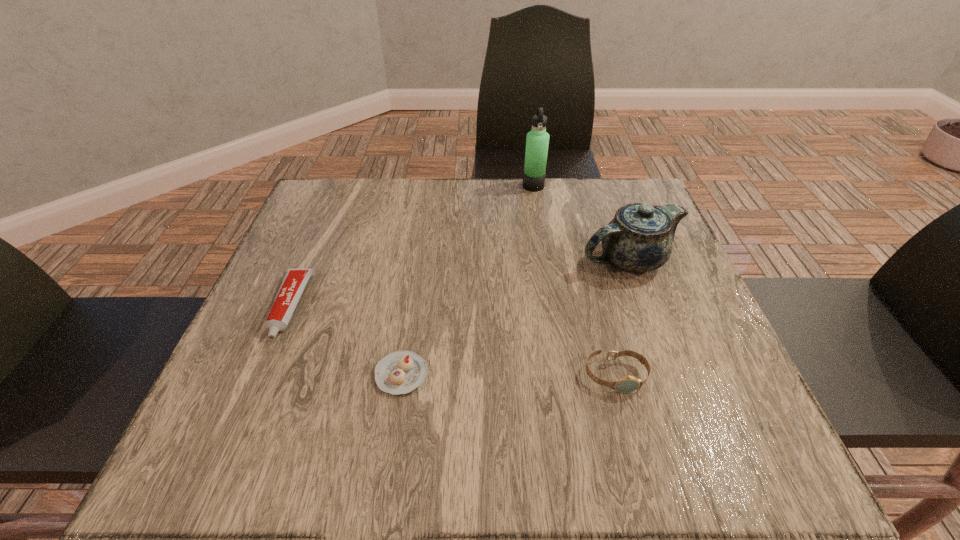
This screenshot has height=540, width=960. I want to click on the third object from left to right, so click(x=537, y=141).

Find the location of a particular element. This screenshot has height=540, width=960. the farthest object is located at coordinates (537, 141).

You are a GUI agent. You are given a task and a screenshot of the screen. Output one action in this format:
    pyautogui.click(x=<x>, y=<y>)
    Task: Click on the second tallest object
    The width and height of the screenshot is (960, 540).
    Given the screenshot: What is the action you would take?
    pyautogui.click(x=639, y=238)

This screenshot has height=540, width=960. I want to click on the third tallest object, so click(626, 384).

The height and width of the screenshot is (540, 960). I want to click on the leftmost object, so click(x=294, y=281).

You are a GUI agent. You are given a task and a screenshot of the screen. Output one action in this format:
    pyautogui.click(x=<x>, y=<y>)
    Task: Click on the second object from left to right
    This screenshot has height=540, width=960.
    Given the screenshot: What is the action you would take?
    pyautogui.click(x=400, y=372)

This screenshot has height=540, width=960. I want to click on free space located on the front of the farthest object, so click(547, 273).

Locate an element on the screen. blank area located from the spout of the second tallest object is located at coordinates (480, 260).

Image resolution: width=960 pixels, height=540 pixels. What are the coordinates of `free region located 0.230m from the spout of the second tallest object` in the screenshot? It's located at (476, 260).

What are the coordinates of `vacant space located from the spout of the second tallest object` in the screenshot? It's located at (534, 260).